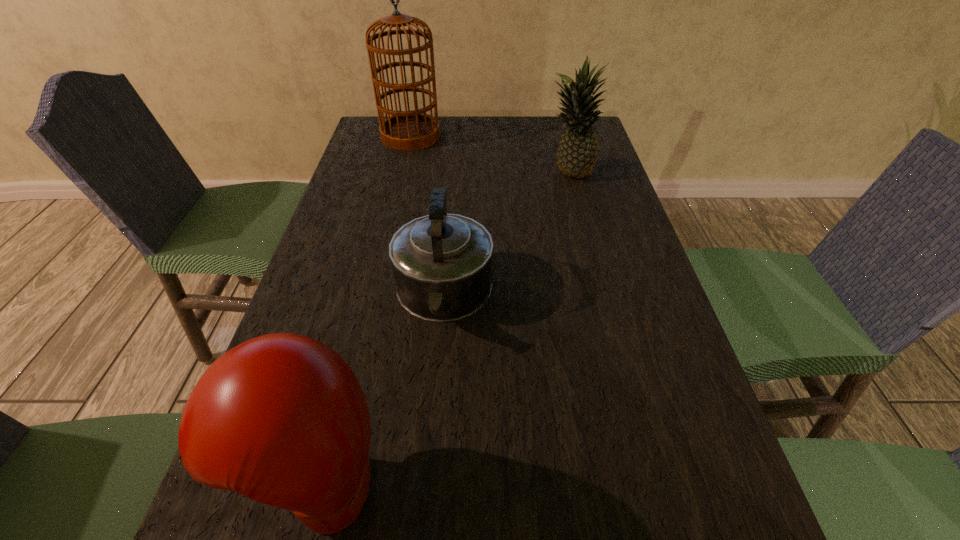
In order to click on the tallest object in this screenshot , I will do coord(405,130).

This screenshot has height=540, width=960. Identify the location of birdcage. (405, 130).

Find the location of a particular element. the second farthest object is located at coordinates (577, 153).

I want to click on the rightmost object, so click(577, 153).

Locate an element on the screen. The image size is (960, 540). the third farthest object is located at coordinates (442, 263).

Where is `kettle`? This screenshot has height=540, width=960. kettle is located at coordinates (442, 263).

This screenshot has width=960, height=540. What are the coordinates of `free space located on the front of the birdcage` in the screenshot? It's located at (396, 197).

Find the location of a particular element. This screenshot has height=540, width=960. vacant region located on the front of the pineapple is located at coordinates (587, 241).

Find the location of a particular element. vacant region located 0.210m with the spout at the front of the shortest object is located at coordinates (431, 459).

I want to click on object at the far edge, so click(405, 130).